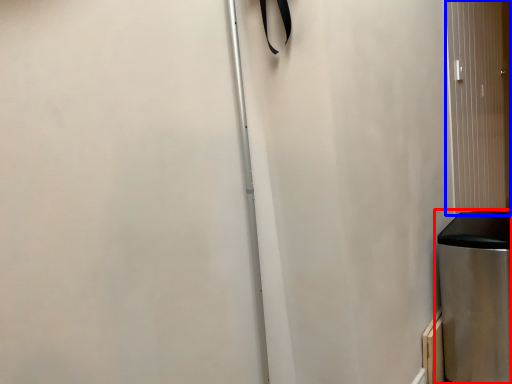
Question: Among these objects, which one is farthest to the camera, waste container (highlighted by a red box) or screen door (highlighted by a blue box)?

Choices:
 (A) waste container
 (B) screen door

Answer: (B)